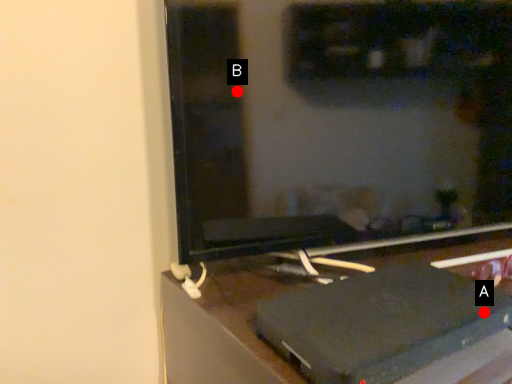
Question: Two points are circled on the image, labeled by A and B beside each circle. Which of the following is the closest to the observer?

Choices:
 (A) A is closer
 (B) B is closer

Answer: (A)